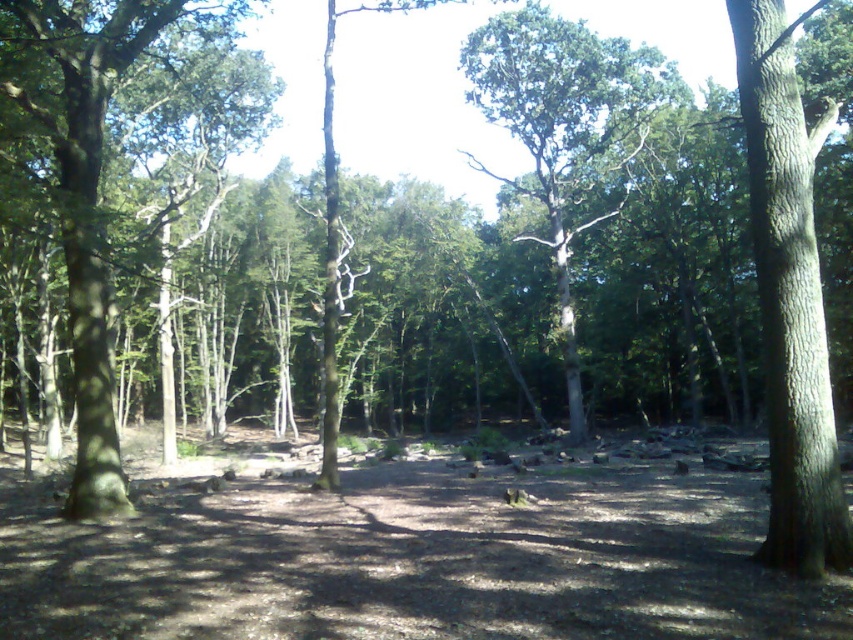
Is point (790, 490) positioned after point (120, 509)?

No, it is not.

Is smooth bark tree at right thinner than green matte tree at left?

No, smooth bark tree at right is not thinner than green matte tree at left.

Is point (776, 60) closer to camera compared to point (79, 490)?

Yes, it is.

Locate an element on the screen. The height and width of the screenshot is (640, 853). smooth bark tree at right is located at coordinates (788, 296).

Is smooth bark tree at right positioned before green leafy tree at center?

Yes, it is.

In the scene shown: Does smooth bark tree at right have a larger size compared to green leafy tree at center?

No.

The height and width of the screenshot is (640, 853). Identify the location of smooth bark tree at right. (788, 296).

Can you confirm if green leafy tree at center is thinner than green matte tree at left?

In fact, green leafy tree at center might be wider than green matte tree at left.

Who is positioned more to the left, green leafy tree at center or green matte tree at left?

Positioned to the left is green matte tree at left.

You are a GUI agent. You are given a task and a screenshot of the screen. Output one action in this format:
    pyautogui.click(x=<x>, y=<y>)
    Task: Click on the green leafy tree at center
    The height and width of the screenshot is (640, 853).
    Given the screenshot: What is the action you would take?
    pyautogui.click(x=566, y=131)

Where is `green leafy tree at center`? This screenshot has width=853, height=640. green leafy tree at center is located at coordinates (566, 131).